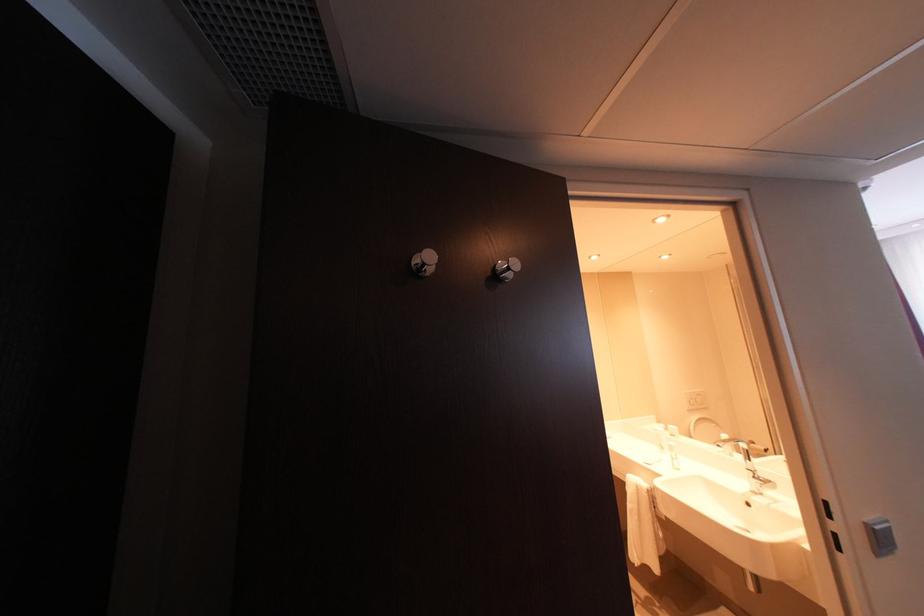
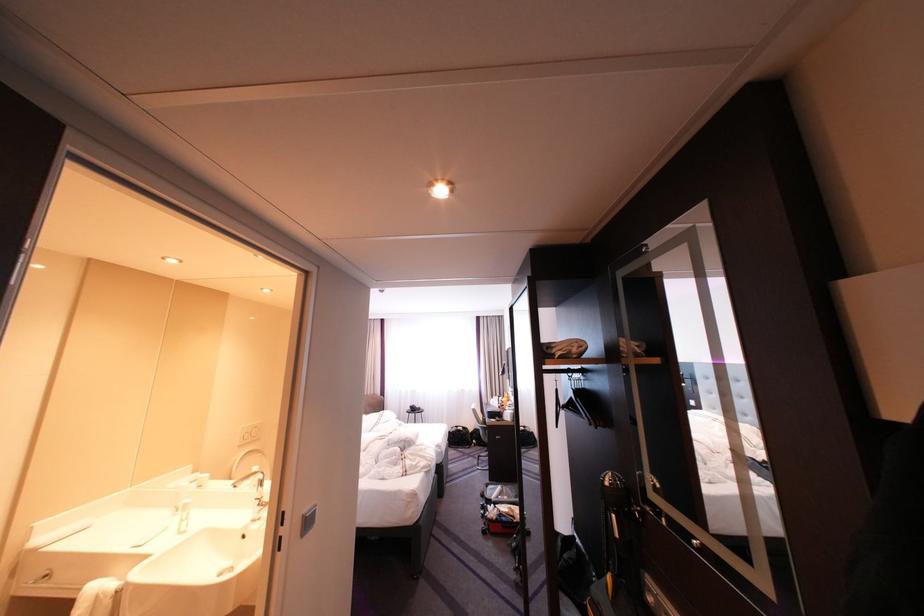
Where in the second image is the point corresponding to pixel 697 394 from the first image?

(254, 429)